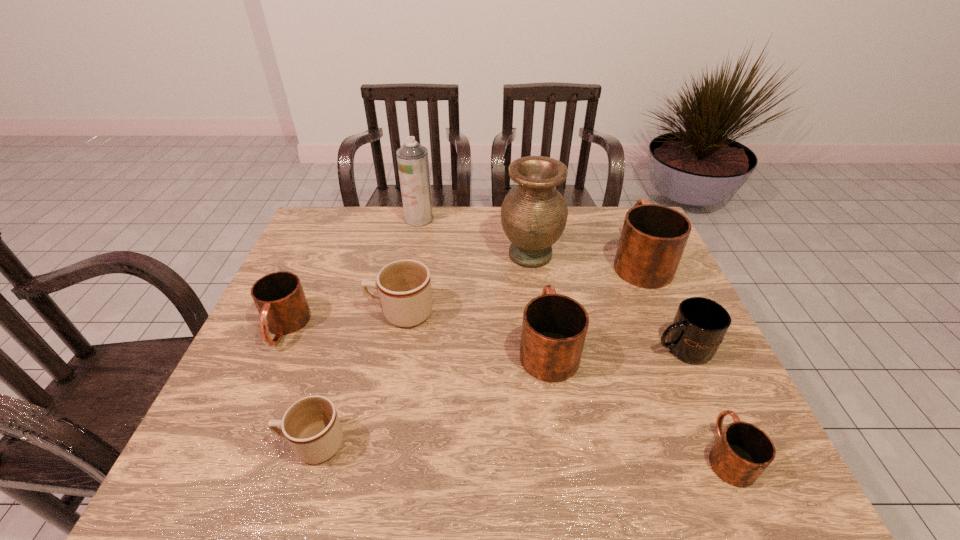
At what (x,y) coordinates should I click in order to perform the action: click on the nearer brown mug. Please return your answer as a coordinate pair (x, y). Looking at the image, I should click on (311, 426).

Find the location of a particular element. the smallest rust mug is located at coordinates (743, 451).

Find the location of `free space located 0.170m on the right of the aerosol can`. free space located 0.170m on the right of the aerosol can is located at coordinates (482, 219).

Locate an element on the screen. The width and height of the screenshot is (960, 540). vacant space located on the right of the green vase is located at coordinates (592, 254).

This screenshot has height=540, width=960. In order to click on vacant space located on the side of the farthest mug with the handle in this screenshot , I will do `click(625, 226)`.

Where is `vacant space positioned 0.090m on the side of the farthest mug with the handle`? The image size is (960, 540). vacant space positioned 0.090m on the side of the farthest mug with the handle is located at coordinates point(622,220).

Where is `free space located on the side of the second rust mug from left to right with the handle`? This screenshot has width=960, height=540. free space located on the side of the second rust mug from left to right with the handle is located at coordinates (538, 275).

Identify the location of blank space located 0.170m on the side of the second rust mug from left to right with the handle. (537, 273).

Identify the location of vacant area situated on the side of the second rust mug from left to right with the handle. This screenshot has height=540, width=960. (538, 278).

You are a GUI agent. You are given a task and a screenshot of the screen. Output one action in this format:
    pyautogui.click(x=<x>, y=<y>)
    Task: Click on the blank area located on the side of the bigger brown mug with the handle
    The image size is (960, 540).
    Given the screenshot: What is the action you would take?
    324,313